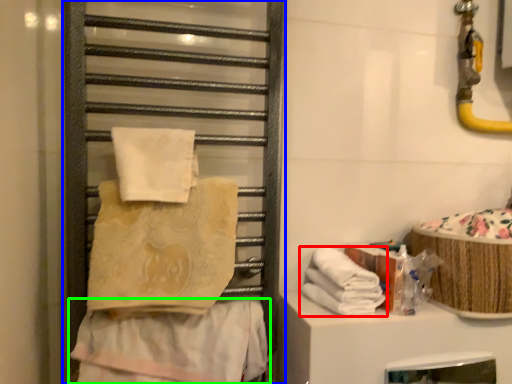
Question: Based on their relative distances, which object is farther from towel (highlighted by a red box)? Choose from cage (highlighted by a blue box) and towel (highlighted by a green box).

Choices:
 (A) cage
 (B) towel

Answer: (A)